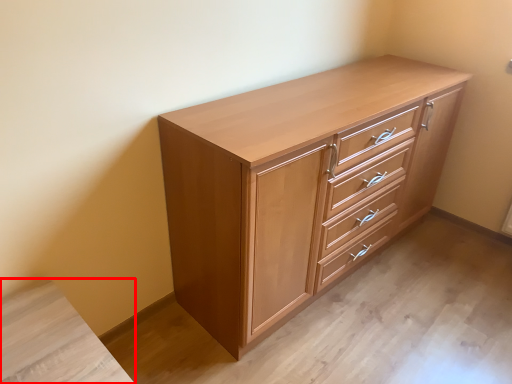
Question: From the image's perspective, what is the correct spatial relationship of vanity (annotated by the red box) in relation to chest of drawers?

Choices:
 (A) above
 (B) below

Answer: (B)